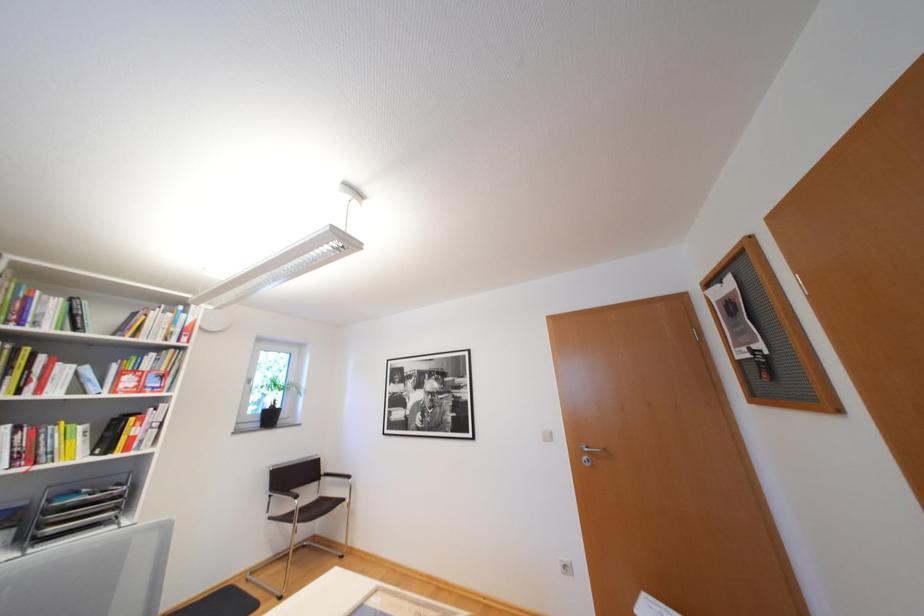
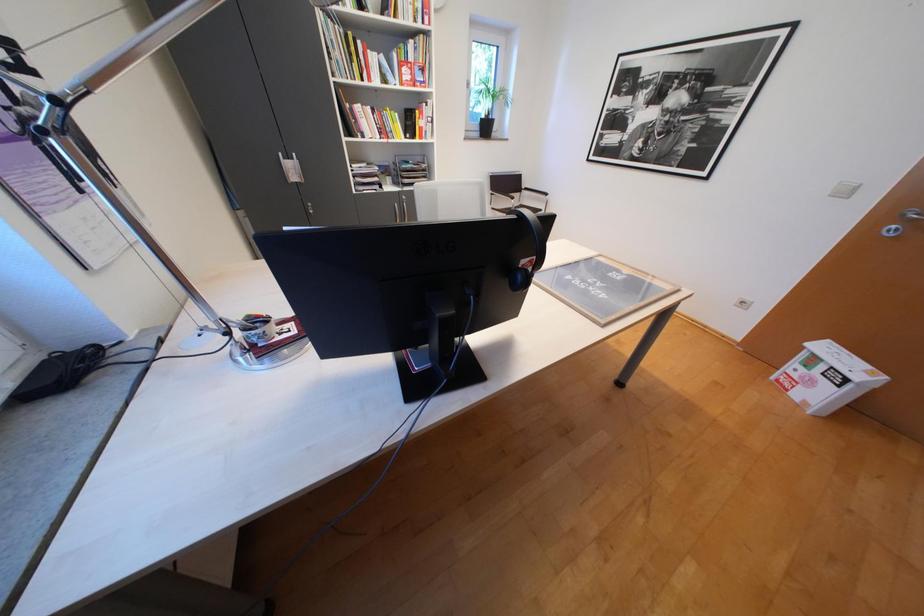
How did the camera likely rotate?

The rotation direction of the camera is left-down.